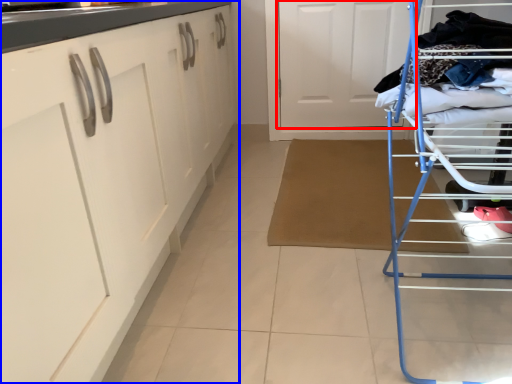
Question: Which object is further to the camera taking this photo, door (highlighted by a red box) or cabinetry (highlighted by a blue box)?

Choices:
 (A) door
 (B) cabinetry

Answer: (A)